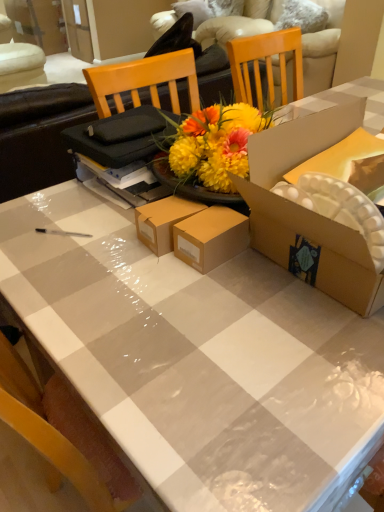
Question: Visually, is cardboard box at center positioned to the left or to the right of beige fabric couch at upper center?

Choices:
 (A) right
 (B) left

Answer: (B)

Question: From the image's perspective, is cardboard box at center above or below beige fabric couch at upper center?

Choices:
 (A) below
 (B) above

Answer: (A)

Question: Looking at their shapes, would you say cardboard box at center is wider or thinner than beige fabric couch at upper center?

Choices:
 (A) wide
 (B) thin

Answer: (B)

Question: From a real-world perspective, is beige fabric couch at upper center physically located above or below cardboard box at center?

Choices:
 (A) below
 (B) above

Answer: (A)

Question: In terms of height, does beige fabric couch at upper center look taller or shorter compared to cardboard box at center?

Choices:
 (A) short
 (B) tall

Answer: (B)

Question: Do you think beige fabric couch at upper center is within cardboard box at center, or outside of it?

Choices:
 (A) inside
 (B) outside

Answer: (B)

Question: Is beige fabric couch at upper center bigger or smaller than cardboard box at center?

Choices:
 (A) small
 (B) big

Answer: (B)